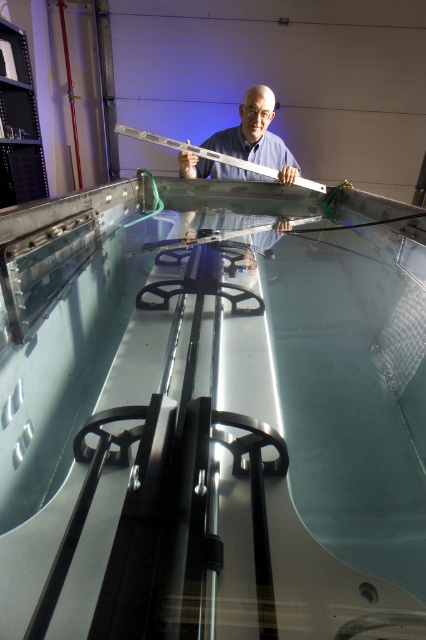
Does matte white ruler at center have a lesser width compared to metallic silver ruler at center?

Indeed, matte white ruler at center has a lesser width compared to metallic silver ruler at center.

Is matte white ruler at center to the left of metallic silver ruler at center from the viewer's perspective?

Incorrect, matte white ruler at center is not on the left side of metallic silver ruler at center.

Describe the element at coordinates (256, 134) in the screenshot. This screenshot has width=426, height=640. I see `matte white ruler at center` at that location.

The image size is (426, 640). What are the coordinates of `matte white ruler at center` in the screenshot? It's located at (256, 134).